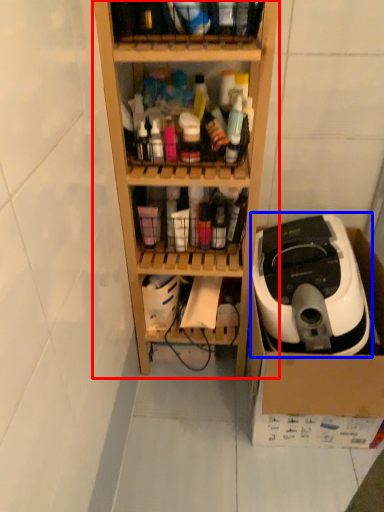
Question: Which object appears farthest to the camera in this image, shelf (highlighted by a red box) or home appliance (highlighted by a blue box)?

Choices:
 (A) shelf
 (B) home appliance

Answer: (B)